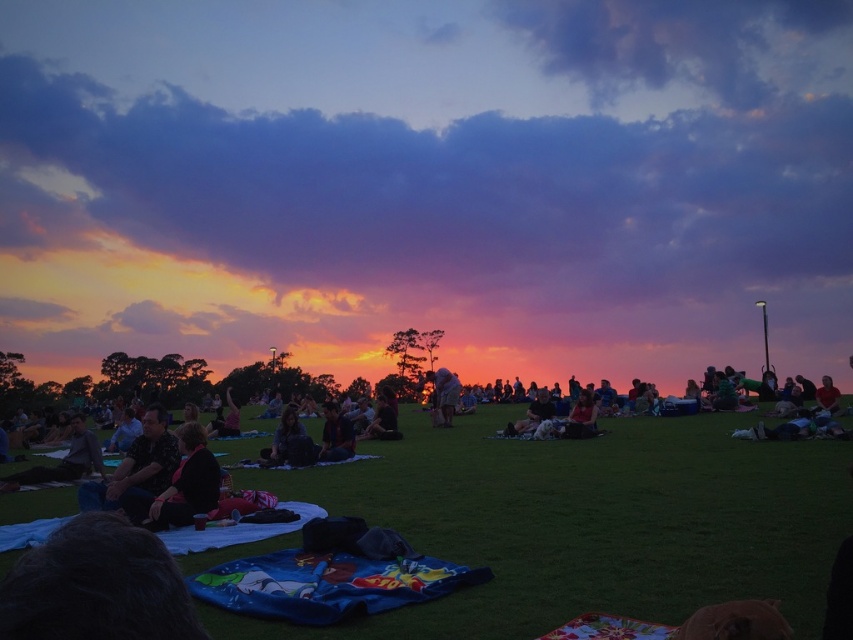
Question: Based on their relative distances, which object is farther from the green grass at center?

Choices:
 (A) dark hair at center
 (B) floral fabric blanket at lower left
 (C) black fabric at center
 (D) dark blue fabric at center

Answer: (C)

Question: Can you confirm if floral fabric blanket at lower left is positioned to the left of black fabric at center?

Choices:
 (A) yes
 (B) no

Answer: (A)

Question: Does dark blue fabric at center have a lesser width compared to black fabric at center?

Choices:
 (A) yes
 (B) no

Answer: (B)

Question: In this image, where is dark hair at center located relative to dark blue fabric at center?

Choices:
 (A) right
 (B) left

Answer: (B)

Question: Which object is positioned farthest from the dark hair at center?

Choices:
 (A) dark blue fabric at center
 (B) green grass at center
 (C) black fabric at center

Answer: (B)

Question: Which object is farther from the camera taking this photo?

Choices:
 (A) dark brown fabric at center
 (B) dark blue fabric at center
 (C) floral fabric blanket at lower left
 (D) green grass at center

Answer: (B)